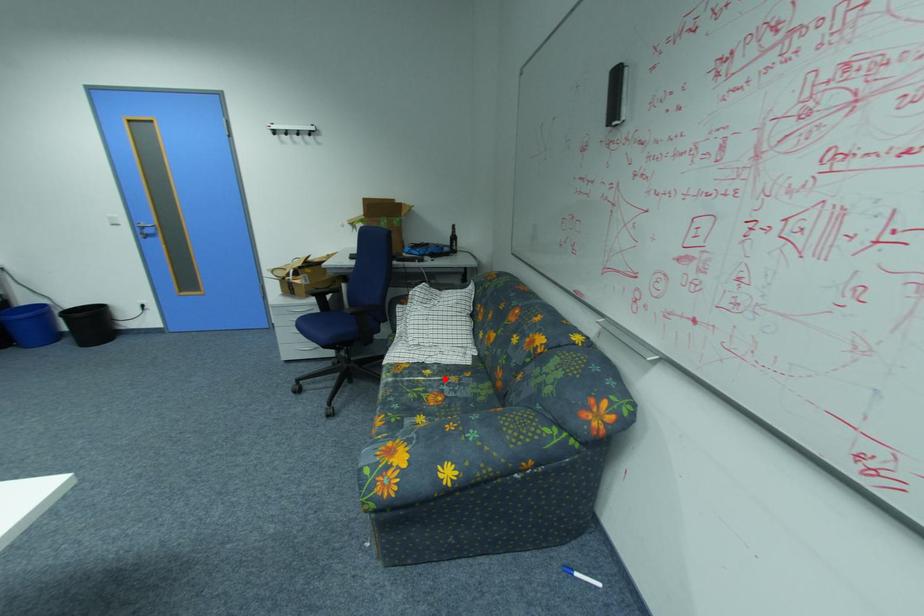
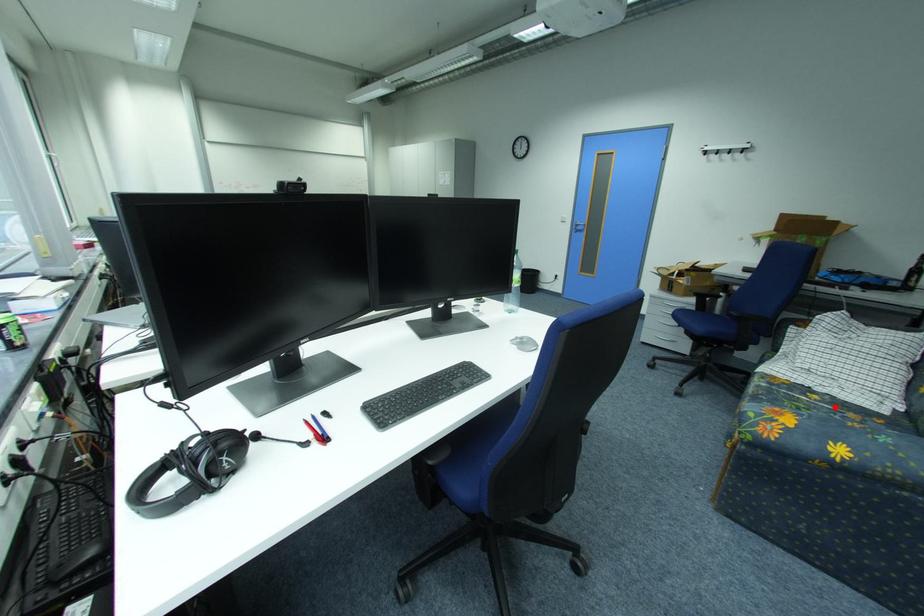
I am providing you with two images of the same scene from different viewpoints. A red point is marked on the first image and another point is marked on the second image. Are the points marked in image1 and image2 representing the same 3D position?

Yes